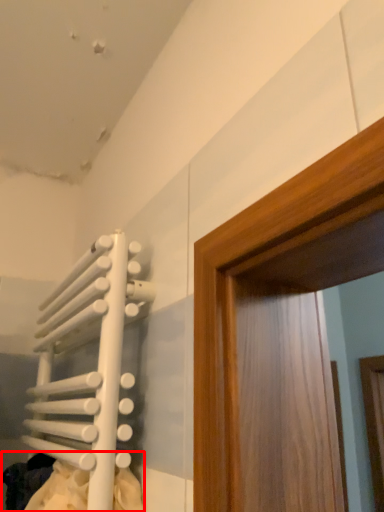
Question: In this image, where is laundry (annotated by the red box) located relative to radiator?

Choices:
 (A) right
 (B) left

Answer: (A)